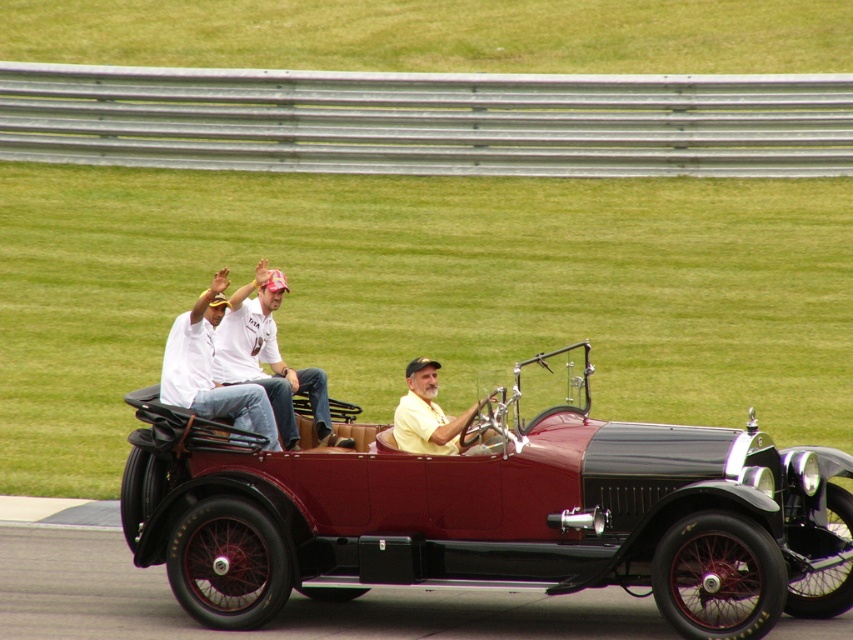
You are standing at the point marked by the coordinates point (270, 358) in the vintage car scene. What object is located exactly at your current position?

The point (270, 358) marks the location of the white cotton shirt at center.

You are a passenger in the vintage car and want to hand a map to the person wearing the white cotton shirt at center. Since you are sitting in the yellow matte shirt at center, which direction should you lean to reach them?

The yellow matte shirt at center is behind the white cotton shirt at center, so you should lean forward to reach the person in the white cotton shirt at center.